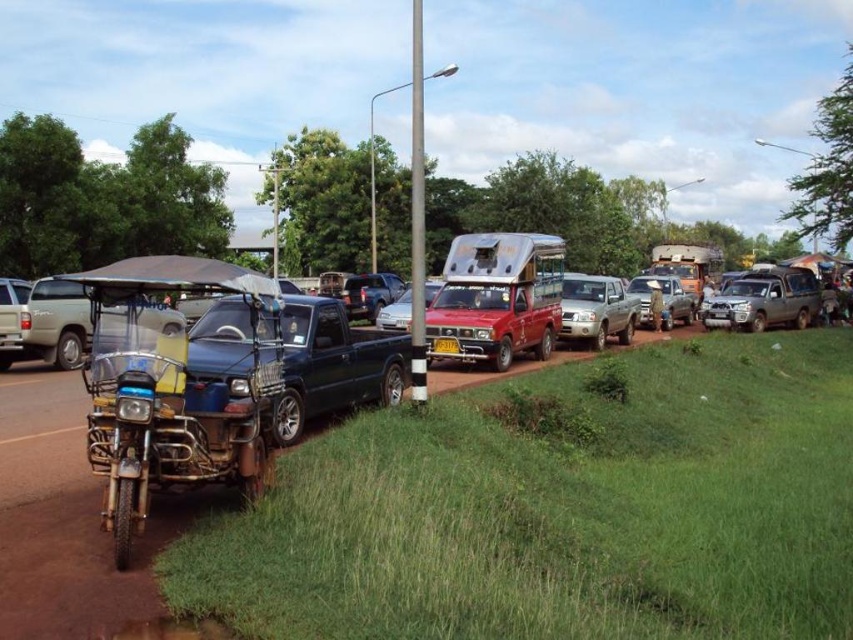
You are a delivery person trying to park your 1.8 meters wide motorcycle between the satin silver sedan at center and the yellow plastic license plate at center. Can you fit your motorcycle in the space between them?

The satin silver sedan at center is wider than the yellow plastic license plate at center. Since the sedan is wider, the space between them might be sufficient for your motorcycle. However, without knowing the exact distance between the two objects, it is uncertain if the 1.8 meters width of the motorcycle will fit. You should measure the space before attempting to park.

Based on the photo, you are a delivery person needing to park your motorcycle between the metallic blue motorcycle at left and the silver metallic pickup truck at center. Can you fit your motorcycle which is 2 meters long in the space between them?

The metallic blue motorcycle at left and the silver metallic pickup truck at center are 16.20 meters apart. Since your motorcycle is only 2 meters long, there is sufficient space between them to park your motorcycle.

You are a delivery person trying to read the license plate of the satin silver sedan at center. Can you see the yellow plastic license plate at center from your current position?

The satin silver sedan at center is above the yellow plastic license plate at center, so the sedan is blocking the view of the license plate making it difficult to see.